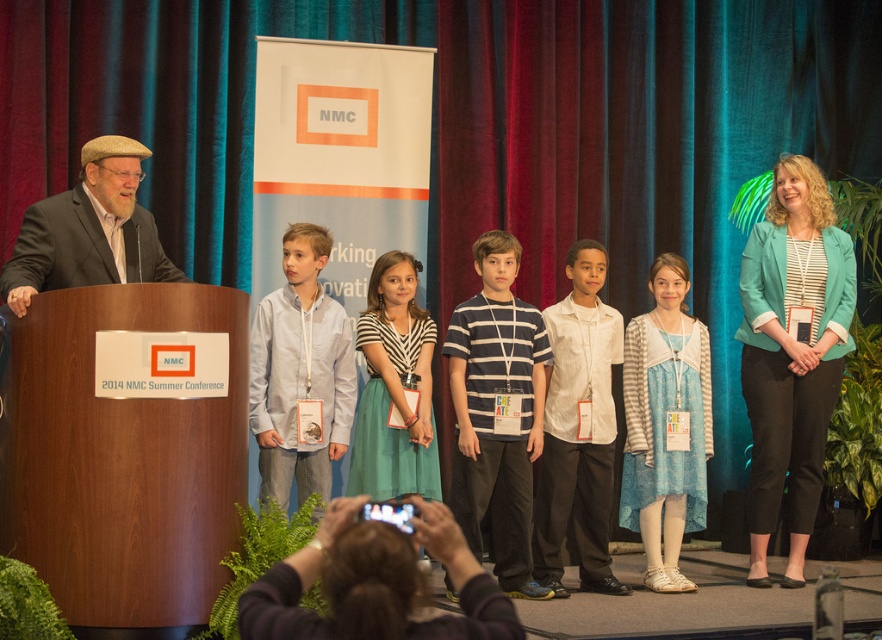
You are standing on the stage at the NMC 2014 Summer Conference. You need to walk from point (x=462, y=620) to point (x=270, y=483). Which direction should you move in to get closer to your destination?

To move from point (x=462, y=620) to point (x=270, y=483), you should move backward since point (x=462, y=620) is closer to the viewer than point (x=270, y=483).

You are attending the NMC 2014 Summer Conference and notice two attendees wearing shirts at the center of the stage. Which shirt, the white striped shirt at center or the light blue shirt at center, is bigger in size?

The white striped shirt at center is larger in size compared to the light blue shirt at center.